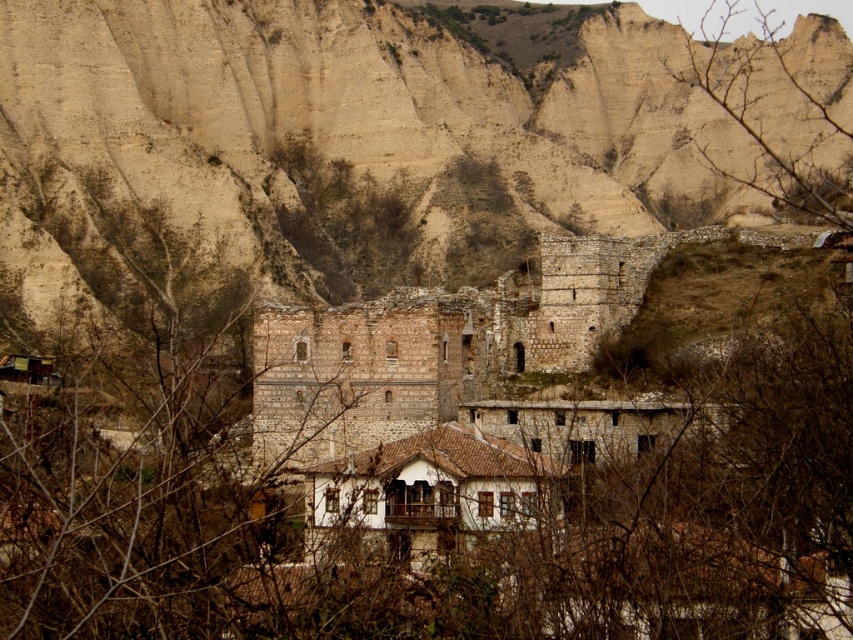
You are an architect examining the village layout. You notice the beige stone wall at center and the bare branches at upper right. Which object is located more to the left in the scene?

The beige stone wall at center is positioned on the left side of bare branches at upper right, so it is more to the left.

You are a visitor standing in the village and want to take a photo of the beige stone wall at center and the bare branches at upper right. Which object should you focus on first if you want to capture both in a single frame without moving the camera?

You should focus on the beige stone wall at center first because it is located below the bare branches at upper right, so adjusting the camera to include both would require ensuring the lower object is framed properly before the upper one.

You are standing at the base of the cliff in the village and see two points marked in the image. The first point is at coordinates point (148, 144) and the second is at point (799, 150). Which point is closer to you?

Point (148, 144) is closer to you because it is in front of point (799, 150).